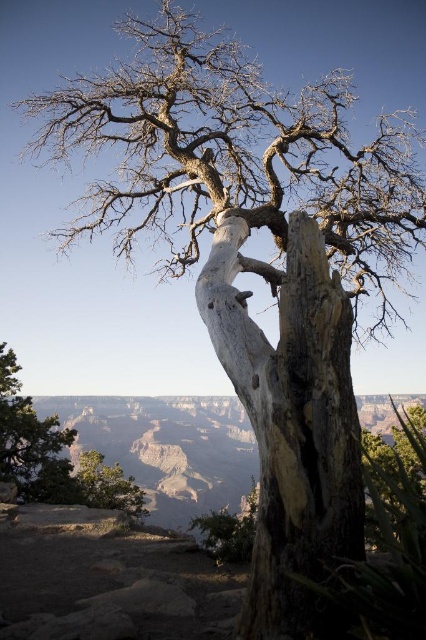
Question: Which of the following is the farthest from the observer?

Choices:
 (A) [x=290, y=358]
 (B) [x=51, y=468]

Answer: (B)

Question: Is the position of white textured bark at center less distant than that of green rough bark tree at lower left?

Choices:
 (A) no
 (B) yes

Answer: (B)

Question: Which of the following is the farthest from the observer?

Choices:
 (A) white textured bark at center
 (B) green rough bark tree at lower left

Answer: (B)

Question: Is white textured bark at center to the left of green rough bark tree at lower left from the viewer's perspective?

Choices:
 (A) yes
 (B) no

Answer: (B)

Question: Is white textured bark at center above green rough bark tree at lower left?

Choices:
 (A) yes
 (B) no

Answer: (A)